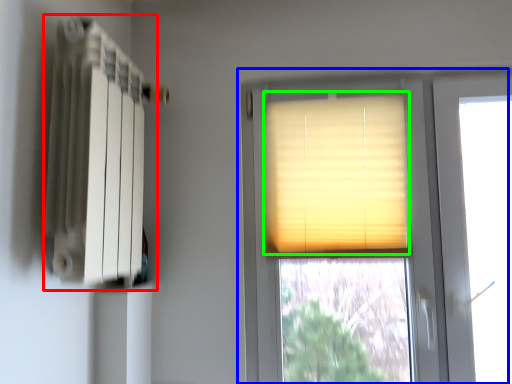
Question: Which object is positioned farthest from radiator (highlighted by a red box)? Select from window (highlighted by a blue box) and window blind (highlighted by a green box).

Choices:
 (A) window
 (B) window blind

Answer: (A)